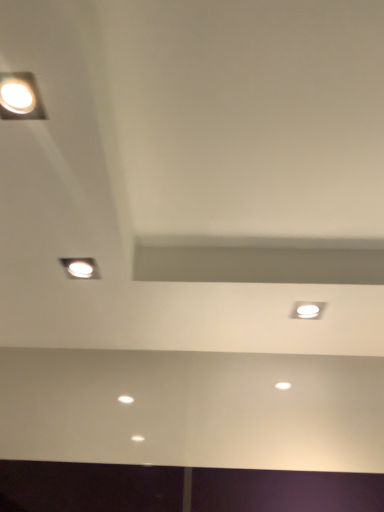
Question: From a real-world perspective, is matte white light fixture at upper left, the second lamp in the bottom-to-top sequence, on white glossy light fixture at upper right?

Choices:
 (A) yes
 (B) no

Answer: (A)

Question: Is matte white light fixture at upper left, acting as the second lamp starting from the back, looking in the opposite direction of white glossy light fixture at upper right?

Choices:
 (A) no
 (B) yes

Answer: (A)

Question: Does matte white light fixture at upper left, which is the 1th lamp from top to bottom, contain white glossy light fixture at upper right?

Choices:
 (A) no
 (B) yes

Answer: (A)

Question: Is matte white light fixture at upper left, the second lamp in the bottom-to-top sequence, closer to camera compared to white glossy light fixture at upper right?

Choices:
 (A) yes
 (B) no

Answer: (A)

Question: Is matte white light fixture at upper left, the 1th lamp in the front-to-back sequence, smaller than white glossy light fixture at upper right?

Choices:
 (A) yes
 (B) no

Answer: (B)

Question: Is matte white light fixture at upper left, which is the 1th lamp from top to bottom, situated inside matte silver lamp at upper left, which is counted as the second lamp, starting from the top, or outside?

Choices:
 (A) inside
 (B) outside

Answer: (B)

Question: Is matte white light fixture at upper left, acting as the second lamp starting from the back, wider or thinner than matte silver lamp at upper left, which is the 2th lamp in front-to-back order?

Choices:
 (A) thin
 (B) wide

Answer: (A)

Question: From a real-world perspective, is matte white light fixture at upper left, the 1th lamp in the front-to-back sequence, above or below matte silver lamp at upper left, placed as the 1th lamp when sorted from back to front?

Choices:
 (A) below
 (B) above

Answer: (B)

Question: In terms of height, does matte white light fixture at upper left, the second lamp in the bottom-to-top sequence, look taller or shorter compared to matte silver lamp at upper left, placed as the 1th lamp when sorted from back to front?

Choices:
 (A) short
 (B) tall

Answer: (A)

Question: Would you say matte silver lamp at upper left, which ranks as the first lamp in bottom-to-top order, is to the left or to the right of white glossy light fixture at upper right in the picture?

Choices:
 (A) right
 (B) left

Answer: (B)

Question: Relative to white glossy light fixture at upper right, is matte silver lamp at upper left, which ranks as the first lamp in bottom-to-top order, in front or behind?

Choices:
 (A) front
 (B) behind

Answer: (A)

Question: Does point (69, 266) appear closer or farther from the camera than point (306, 314)?

Choices:
 (A) farther
 (B) closer

Answer: (B)

Question: From a real-world perspective, relative to white glossy light fixture at upper right, is matte silver lamp at upper left, which is the 2th lamp in front-to-back order, vertically above or below?

Choices:
 (A) above
 (B) below

Answer: (A)

Question: Considering the positions of matte silver lamp at upper left, placed as the 1th lamp when sorted from back to front, and matte white light fixture at upper left, the 1th lamp in the front-to-back sequence, in the image, is matte silver lamp at upper left, placed as the 1th lamp when sorted from back to front, wider or thinner than matte white light fixture at upper left, the 1th lamp in the front-to-back sequence,?

Choices:
 (A) thin
 (B) wide

Answer: (A)

Question: From a real-world perspective, is matte silver lamp at upper left, which is the 2th lamp in front-to-back order, above or below matte white light fixture at upper left, which is the 1th lamp from top to bottom?

Choices:
 (A) above
 (B) below

Answer: (B)